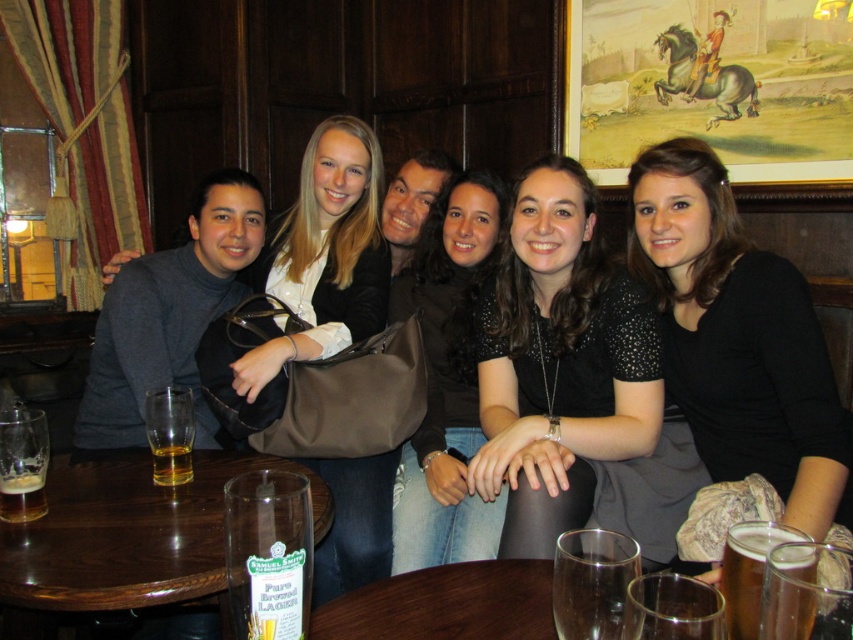
Question: Which is farther from the clear glass beer at lower right?

Choices:
 (A) matte black purse at center
 (B) translucent glass beer at table center
 (C) translucent glass beer at table left
 (D) black sparkly shirt at center

Answer: (A)

Question: Is amber glass beer at lower right bigger than clear glass beer at lower right?

Choices:
 (A) no
 (B) yes

Answer: (B)

Question: Can you confirm if black sequined dress at center is positioned above wooden table at center?

Choices:
 (A) no
 (B) yes

Answer: (B)

Question: Is wooden table at center behind translucent glass beer at table left?

Choices:
 (A) no
 (B) yes

Answer: (A)

Question: Which is nearer to the amber glass beer at lower right?

Choices:
 (A) brown wooden table at lower left
 (B) black sequined dress at center

Answer: (B)

Question: Estimate the real-world distances between objects in this image. Which object is closer to the amber glass beer at lower right?

Choices:
 (A) matte black purse at center
 (B) black sparkly shirt at center
 (C) black sequined dress at center

Answer: (B)